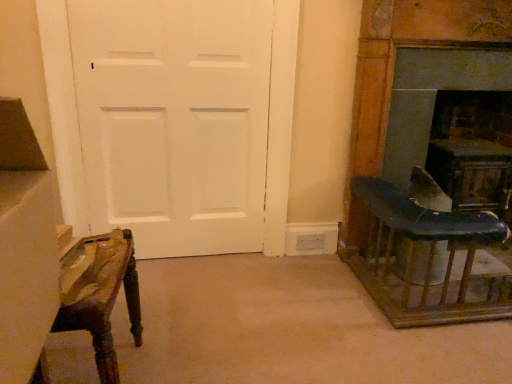
Question: Can you confirm if white matte door at left is smaller than wooden chair at right?

Choices:
 (A) no
 (B) yes

Answer: (B)

Question: Can you confirm if white matte door at left is positioned to the right of wooden chair at right?

Choices:
 (A) yes
 (B) no

Answer: (B)

Question: Is white matte door at left taller than wooden chair at right?

Choices:
 (A) no
 (B) yes

Answer: (B)

Question: From the image's perspective, is white matte door at left on wooden chair at right?

Choices:
 (A) yes
 (B) no

Answer: (A)

Question: From a real-world perspective, is white matte door at left positioned under wooden chair at right based on gravity?

Choices:
 (A) yes
 (B) no

Answer: (B)

Question: Is white matte door at left facing away from wooden chair at right?

Choices:
 (A) no
 (B) yes

Answer: (A)

Question: Considering the relative positions of wooden chair at right and blue leather chair at right in the image provided, is wooden chair at right in front of blue leather chair at right?

Choices:
 (A) yes
 (B) no

Answer: (A)

Question: Is wooden chair at right at the right side of blue leather chair at right?

Choices:
 (A) yes
 (B) no

Answer: (B)

Question: Is wooden chair at right thinner than blue leather chair at right?

Choices:
 (A) no
 (B) yes

Answer: (A)

Question: Does wooden chair at right appear on the left side of blue leather chair at right?

Choices:
 (A) no
 (B) yes

Answer: (B)

Question: Can you confirm if wooden chair at right is taller than blue leather chair at right?

Choices:
 (A) yes
 (B) no

Answer: (B)

Question: Is blue leather chair at right surrounded by wooden chair at right?

Choices:
 (A) yes
 (B) no

Answer: (B)

Question: Is blue leather chair at right smaller than dark gray stone fireplace at right?

Choices:
 (A) yes
 (B) no

Answer: (A)